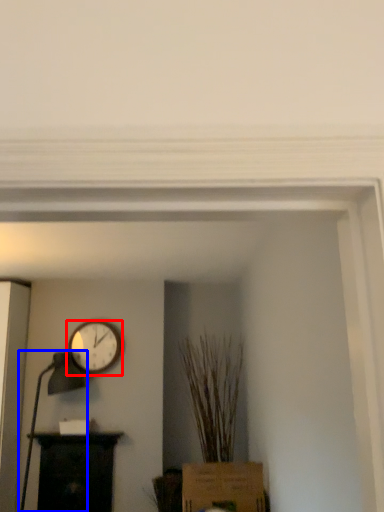
Question: Among these objects, which one is nearest to the camera, wall clock (highlighted by a red box) or table lamp (highlighted by a blue box)?

Choices:
 (A) wall clock
 (B) table lamp

Answer: (B)